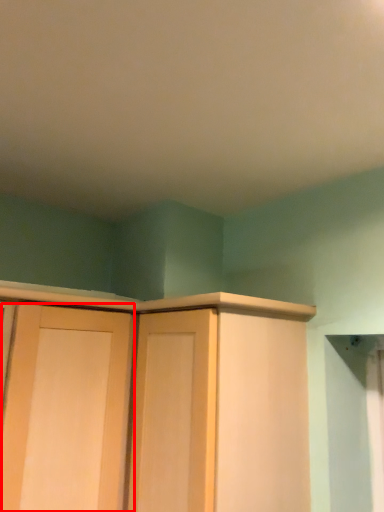
Question: From the image's perspective, where is door (annotated by the red box) located in relation to cupboard in the image?

Choices:
 (A) above
 (B) below

Answer: (B)